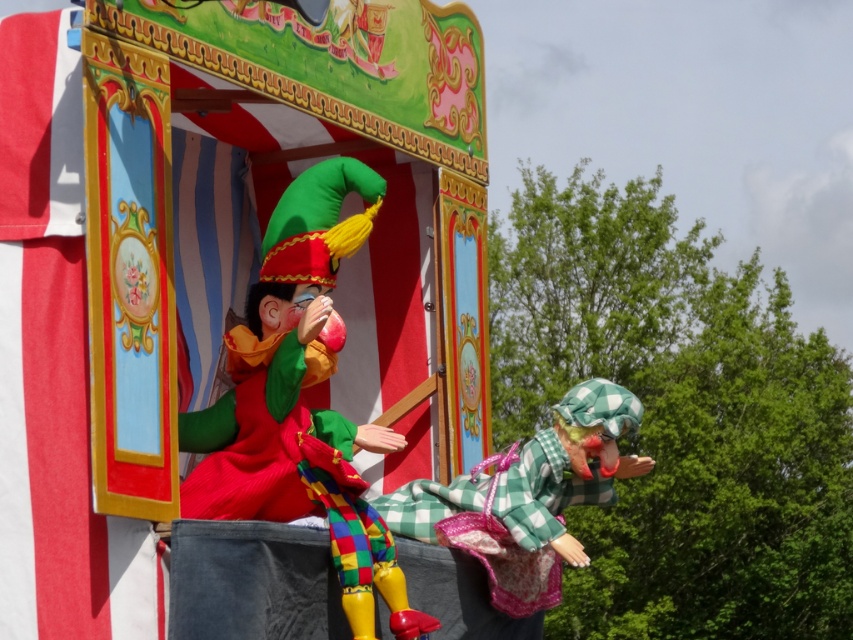
Question: Which point is closer to the camera?

Choices:
 (A) matte plastic clown at center
 (B) green checkered dress at center

Answer: (A)

Question: Which object appears farthest from the camera in this image?

Choices:
 (A) matte plastic clown at center
 (B) green checkered dress at center

Answer: (B)

Question: Is matte plastic clown at center positioned before green checkered dress at center?

Choices:
 (A) yes
 (B) no

Answer: (A)

Question: Does matte plastic clown at center appear under green checkered dress at center?

Choices:
 (A) yes
 (B) no

Answer: (B)

Question: Among these objects, which one is farthest from the camera?

Choices:
 (A) green checkered dress at center
 (B) matte plastic clown at center

Answer: (A)

Question: Where is matte plastic clown at center located in relation to green checkered dress at center in the image?

Choices:
 (A) above
 (B) below

Answer: (A)